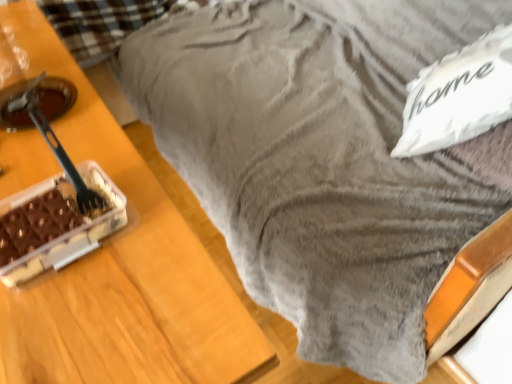
You are a GUI agent. You are given a task and a screenshot of the screen. Output one action in this format:
    pyautogui.click(x=<x>, y=<y>)
    Task: Click on the chocolate matte cake at left
    The image size is (512, 384).
    Given the screenshot: What is the action you would take?
    pyautogui.click(x=73, y=232)

Which of these two, black plastic fork at left or chocolate matte cake at left, stands shorter?

chocolate matte cake at left.

Does point (93, 200) appear closer or farther from the camera than point (88, 179)?

Point (93, 200) appears to be closer to the viewer than point (88, 179).

Based on the photo, considering the relative positions of black plastic fork at left and chocolate matte cake at left in the image provided, is black plastic fork at left behind chocolate matte cake at left?

Yes, the depth of black plastic fork at left is greater than that of chocolate matte cake at left.

Are white fluffy pillow at upper right and chocolate matte cake at left located far from each other?

white fluffy pillow at upper right is near chocolate matte cake at left, not far away.

Is chocolate matte cake at left completely or partially inside white fluffy pillow at upper right?

Result: That's incorrect, chocolate matte cake at left is not inside white fluffy pillow at upper right.

From a real-world perspective, is white fluffy pillow at upper right physically above chocolate matte cake at left?

No, from a real-world perspective, white fluffy pillow at upper right is not on top of chocolate matte cake at left.

Is the depth of white fluffy pillow at upper right greater than that of chocolate matte cake at left?

That is True.

Based on the photo, based on their positions, is chocolate matte cake at left located to the left or right of black plastic fork at left?

From the image, it's evident that chocolate matte cake at left is to the right of black plastic fork at left.

Could you tell me if chocolate matte cake at left is turned towards black plastic fork at left?

No, chocolate matte cake at left is not oriented towards black plastic fork at left.

Is chocolate matte cake at left inside or outside of black plastic fork at left?

chocolate matte cake at left is spatially situated outside black plastic fork at left.

Considering the relative sizes of white fluffy pillow at upper right and black plastic fork at left in the image provided, is white fluffy pillow at upper right wider than black plastic fork at left?

Indeed, white fluffy pillow at upper right has a greater width compared to black plastic fork at left.

Considering the relative sizes of white fluffy pillow at upper right and black plastic fork at left in the image provided, is white fluffy pillow at upper right shorter than black plastic fork at left?

No.

Where is `utensil in front of the white fluffy pillow at upper right`? The height and width of the screenshot is (384, 512). utensil in front of the white fluffy pillow at upper right is located at coordinates (66, 163).

Is white fluffy pillow at upper right inside the boundaries of black plastic fork at left, or outside?

white fluffy pillow at upper right exists outside the volume of black plastic fork at left.

Locate an element on the screen. pillow above the chocolate matte cake at left (from the image's perspective) is located at coordinates point(459,96).

From the picture: Does chocolate matte cake at left turn towards white fluffy pillow at upper right?

No, chocolate matte cake at left is not oriented towards white fluffy pillow at upper right.

Is chocolate matte cake at left wider or thinner than white fluffy pillow at upper right?

chocolate matte cake at left is thinner than white fluffy pillow at upper right.

Which is behind, point (62, 183) or point (414, 110)?

The point (414, 110) is more distant.

Which point is more forward, (52,137) or (505,32)?

The point (52,137) is closer.

Considering the sizes of objects black plastic fork at left and white fluffy pillow at upper right in the image provided, who is shorter, black plastic fork at left or white fluffy pillow at upper right?

black plastic fork at left is shorter.

Can you confirm if black plastic fork at left is positioned to the left of white fluffy pillow at upper right?

Yes, black plastic fork at left is to the left of white fluffy pillow at upper right.

From the image's perspective, is black plastic fork at left on white fluffy pillow at upper right?

Actually, black plastic fork at left appears below white fluffy pillow at upper right in the image.

Identify the location of utensil above the chocolate matte cake at left (from a real-world perspective). The image size is (512, 384). (66, 163).

Find the location of a particular element. cake that is on the left side of white fluffy pillow at upper right is located at coordinates (73, 232).

Which object lies further to the anchor point chocolate matte cake at left, white fluffy pillow at upper right or black plastic fork at left?

white fluffy pillow at upper right.

Estimate the real-world distances between objects in this image. Which object is further from black plastic fork at left, chocolate matte cake at left or white fluffy pillow at upper right?

The object further to black plastic fork at left is white fluffy pillow at upper right.

From the picture: Looking at the image, which one is located further to black plastic fork at left, white fluffy pillow at upper right or chocolate matte cake at left?

The object further to black plastic fork at left is white fluffy pillow at upper right.

Looking at the image, which one is located closer to white fluffy pillow at upper right, black plastic fork at left or chocolate matte cake at left?

chocolate matte cake at left is closer to white fluffy pillow at upper right.

Based on their spatial positions, is chocolate matte cake at left or black plastic fork at left further from white fluffy pillow at upper right?

black plastic fork at left lies further to white fluffy pillow at upper right than the other object.

Which object lies further to the anchor point chocolate matte cake at left, black plastic fork at left or white fluffy pillow at upper right?

white fluffy pillow at upper right is positioned further to the anchor chocolate matte cake at left.

Locate an element on the screen. The image size is (512, 384). cake between black plastic fork at left and white fluffy pillow at upper right from left to right is located at coordinates (73, 232).